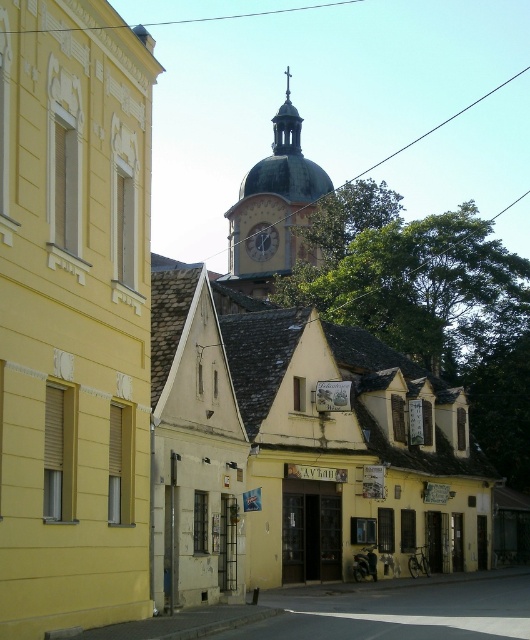
Measure the distance from yellow stucco church at center to golden dome clock tower at upper center.

yellow stucco church at center and golden dome clock tower at upper center are 427.20 feet apart.

This screenshot has height=640, width=530. Describe the element at coordinates (74, 316) in the screenshot. I see `yellow stucco church at center` at that location.

In order to click on yellow stucco church at center in this screenshot , I will do `click(74, 316)`.

Is golden dome clock tower at upper center positioned behind gold metallic clock at center?

No, it is in front of gold metallic clock at center.

Can you confirm if golden dome clock tower at upper center is bigger than gold metallic clock at center?

Correct, golden dome clock tower at upper center is larger in size than gold metallic clock at center.

The image size is (530, 640). Find the location of `golden dome clock tower at upper center`. golden dome clock tower at upper center is located at coordinates (275, 205).

Can you confirm if yellow stucco church at center is wider than gold metallic clock at center?

Incorrect, yellow stucco church at center's width does not surpass gold metallic clock at center's.

Find the location of a particular element. yellow stucco church at center is located at coordinates (74, 316).

Identify the location of yellow stucco church at center. (74, 316).